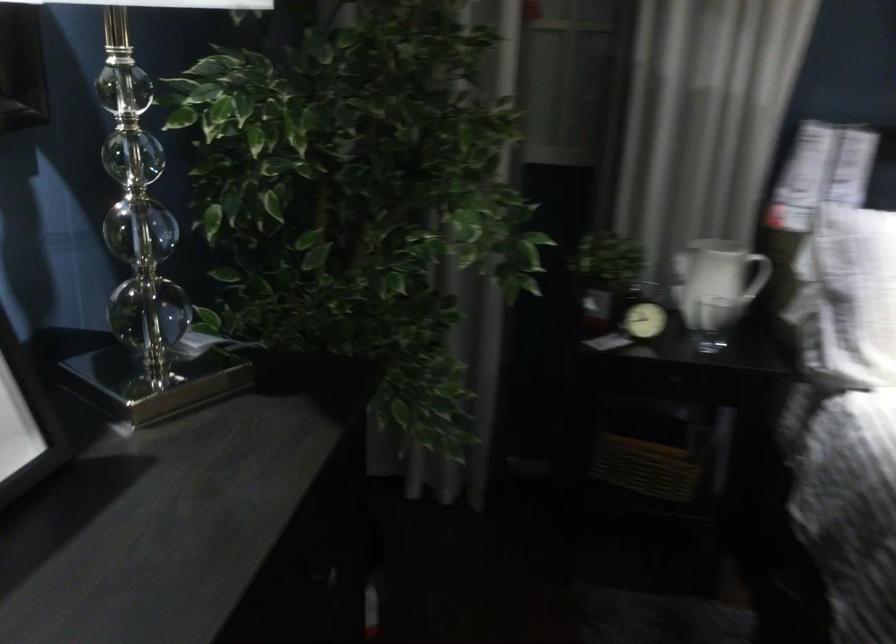
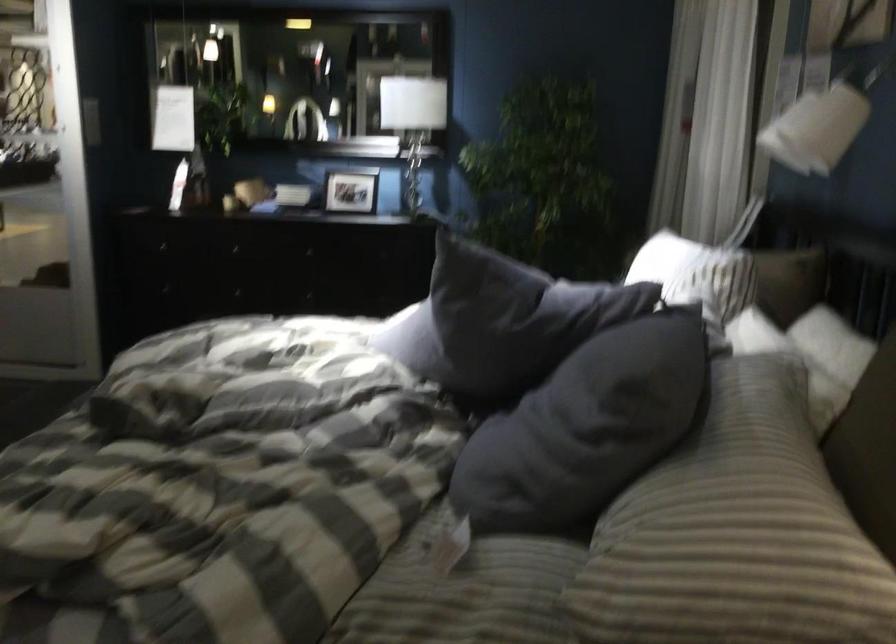
Question: I am providing you with two images of the same scene from different viewpoints. Which of the following objects are not visible in image2?

Choices:
 (A) tall glass bottle
 (B) stack of books
 (C) small potted plant
 (D) dark grey pillow

Answer: (C)